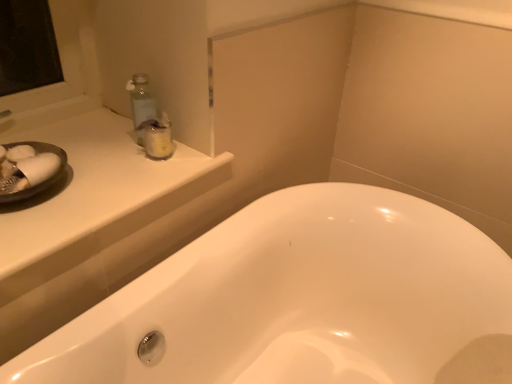
Question: Is white glossy bathtub at center bigger than clear plastic jar at upper left?

Choices:
 (A) yes
 (B) no

Answer: (A)

Question: Could you tell me if white glossy bathtub at center is facing clear plastic jar at upper left?

Choices:
 (A) no
 (B) yes

Answer: (A)

Question: Is white glossy bathtub at center wider than clear plastic jar at upper left?

Choices:
 (A) no
 (B) yes

Answer: (B)

Question: Could clear plastic jar at upper left be considered to be inside white glossy bathtub at center?

Choices:
 (A) yes
 (B) no

Answer: (B)

Question: Does white glossy bathtub at center have a greater height compared to clear plastic jar at upper left?

Choices:
 (A) no
 (B) yes

Answer: (B)

Question: Is white glossy bathtub at center to the left of clear plastic jar at upper left from the viewer's perspective?

Choices:
 (A) no
 (B) yes

Answer: (A)

Question: Is clear plastic jar at upper left taller than white glossy bathtub at center?

Choices:
 (A) yes
 (B) no

Answer: (B)

Question: Is clear plastic jar at upper left positioned before white glossy bathtub at center?

Choices:
 (A) yes
 (B) no

Answer: (B)

Question: Is clear plastic jar at upper left facing towards white glossy bathtub at center?

Choices:
 (A) no
 (B) yes

Answer: (A)

Question: Is clear plastic jar at upper left at the left side of white glossy bathtub at center?

Choices:
 (A) yes
 (B) no

Answer: (A)

Question: Would you say clear plastic jar at upper left is a long distance from white glossy bathtub at center?

Choices:
 (A) no
 (B) yes

Answer: (A)

Question: Can you confirm if clear plastic jar at upper left is shorter than white glossy bathtub at center?

Choices:
 (A) no
 (B) yes

Answer: (B)

Question: Does white glossy bathtub at center lie in front of white glossy counter top at upper left?

Choices:
 (A) yes
 (B) no

Answer: (A)